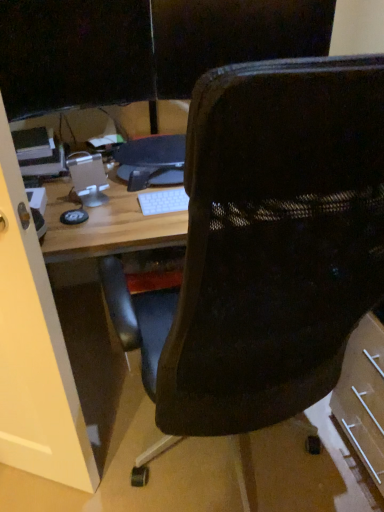
Describe the element at coordinates (152, 161) in the screenshot. I see `black plastic monitor at center` at that location.

Image resolution: width=384 pixels, height=512 pixels. What do you see at coordinates (74, 54) in the screenshot? I see `black glossy monitor at upper left` at bounding box center [74, 54].

Locate an element on the screen. This screenshot has height=512, width=384. black mesh chair at center is located at coordinates (266, 245).

You are a GUI agent. You are given a task and a screenshot of the screen. Output one action in this format:
    pyautogui.click(x=<x>, y=<y>)
    Task: Click on the black mesh chair at upper center
    The width and height of the screenshot is (384, 512).
    Given the screenshot: What is the action you would take?
    pyautogui.click(x=232, y=36)

Measure the distance between black plastic monitor at center and black mesh chair at center.

black plastic monitor at center is 26.64 inches from black mesh chair at center.

Is point (123, 150) positioned before point (271, 279)?

No, (123, 150) is behind (271, 279).

Which of these two, black plastic monitor at center or black mesh chair at center, is thinner?

black plastic monitor at center is thinner.

Based on the photo, which object is positioned more to the left, black plastic monitor at center or black mesh chair at center?

black plastic monitor at center.

Consider the image. Considering the positions of objects black glossy monitor at upper left and black mesh chair at upper center in the image provided, who is behind, black glossy monitor at upper left or black mesh chair at upper center?

black mesh chair at upper center is more distant.

Where is `back lying on the right of black glossy monitor at upper left`? This screenshot has height=512, width=384. back lying on the right of black glossy monitor at upper left is located at coordinates (232, 36).

From the picture: Is black glossy monitor at upper left facing away from black mesh chair at upper center?

black glossy monitor at upper left is not turned away from black mesh chair at upper center.

Looking at their sizes, would you say black glossy monitor at upper left is wider or thinner than black mesh chair at upper center?

In the image, black glossy monitor at upper left appears to be more narrow than black mesh chair at upper center.

Which object is wider, transparent glass door at left or black mesh chair at upper center?

Wider between the two is transparent glass door at left.

Could you tell me if transparent glass door at left is turned towards black mesh chair at upper center?

No, transparent glass door at left is not turned towards black mesh chair at upper center.

From a real-world perspective, is transparent glass door at left located beneath black mesh chair at upper center?

Yes, from a real-world perspective, transparent glass door at left is below black mesh chair at upper center.

How different are the orientations of black glossy monitor at upper left and black plastic monitor at center in degrees?

21.8 degrees separate the facing orientations of black glossy monitor at upper left and black plastic monitor at center.

Locate an element on the screen. This screenshot has height=512, width=384. computer monitor on the left side of black plastic monitor at center is located at coordinates (74, 54).

Which of these two, black glossy monitor at upper left or black plastic monitor at center, is bigger?

Bigger between the two is black glossy monitor at upper left.

From a real-world perspective, between black glossy monitor at upper left and black plastic monitor at center, who is vertically lower?

black plastic monitor at center.

How distant is black mesh chair at upper center from transparent glass door at left?

The distance of black mesh chair at upper center from transparent glass door at left is 3.64 feet.

From the image's perspective, would you say black mesh chair at upper center is shown under transparent glass door at left?

No, from the image's perspective, black mesh chair at upper center is not beneath transparent glass door at left.

Is black mesh chair at upper center spatially inside transparent glass door at left, or outside of it?

The correct answer is: outside.

Is black mesh chair at upper center facing towards transparent glass door at left?

No, black mesh chair at upper center is not facing towards transparent glass door at left.

Is black plastic monitor at center closer to the viewer compared to black mesh chair at upper center?

No, it is not.

Is black plastic monitor at center surrounding black mesh chair at upper center?

No.

Is black plastic monitor at center next to black mesh chair at upper center and touching it?

No, black plastic monitor at center is not in contact with black mesh chair at upper center.

In the scene shown: Does black plastic monitor at center have a larger size compared to black mesh chair at upper center?

Actually, black plastic monitor at center might be smaller than black mesh chair at upper center.

In terms of height, does black mesh chair at upper center look taller or shorter compared to black glossy monitor at upper left?

black mesh chair at upper center is shorter than black glossy monitor at upper left.

Based on the photo, measure the distance between black mesh chair at upper center and black glossy monitor at upper left.

black mesh chair at upper center is 10.95 inches away from black glossy monitor at upper left.

Could you tell me if black mesh chair at upper center is turned towards black glossy monitor at upper left?

No.

This screenshot has width=384, height=512. Find the location of `computer monitor on the left of black mesh chair at upper center`. computer monitor on the left of black mesh chair at upper center is located at coordinates (74, 54).

At what (x,y) coordinates should I click in order to perform the action: click on chair lying below the black plastic monitor at center (from the image's perspective). Please return your answer as a coordinate pair (x, y). This screenshot has width=384, height=512. Looking at the image, I should click on (266, 245).

Where is `computer monitor below the black mesh chair at upper center (from a real-world perspective)`? This screenshot has width=384, height=512. computer monitor below the black mesh chair at upper center (from a real-world perspective) is located at coordinates (74, 54).

Considering their positions, is black glossy monitor at upper left positioned closer to black plastic monitor at center than black mesh chair at upper center?

Based on the image, black glossy monitor at upper left appears to be nearer to black plastic monitor at center.

Looking at this image, which object lies nearer to the anchor point transparent glass door at left, black mesh chair at center or black plastic monitor at center?

Among the two, black mesh chair at center is located nearer to transparent glass door at left.

Estimate the real-world distances between objects in this image. Which object is closer to black glossy monitor at upper left, black mesh chair at center or black mesh chair at upper center?

black mesh chair at upper center is positioned closer to the anchor black glossy monitor at upper left.

Looking at the image, which one is located closer to transparent glass door at left, black mesh chair at upper center or black plastic monitor at center?

black plastic monitor at center.

Estimate the real-world distances between objects in this image. Which object is closer to black mesh chair at center, transparent glass door at left or black glossy monitor at upper left?

transparent glass door at left is positioned closer to the anchor black mesh chair at center.

In the scene shown: Looking at the image, which one is located closer to transparent glass door at left, black plastic monitor at center or black glossy monitor at upper left?

The object closer to transparent glass door at left is black plastic monitor at center.

Based on their spatial positions, is black plastic monitor at center or black mesh chair at upper center further from black glossy monitor at upper left?

black plastic monitor at center is further to black glossy monitor at upper left.

When comparing their distances from black plastic monitor at center, does black mesh chair at upper center or transparent glass door at left seem further?

Among the two, transparent glass door at left is located further to black plastic monitor at center.

At what (x,y) coordinates should I click in order to perform the action: click on computer between black glossy monitor at upper left and black mesh chair at upper center. Please return your answer as a coordinate pair (x, y). The width and height of the screenshot is (384, 512). Looking at the image, I should click on (152, 161).

You are a GUI agent. You are given a task and a screenshot of the screen. Output one action in this format:
    pyautogui.click(x=<x>, y=<y>)
    Task: Click on the glass door between black mesh chair at center and black mesh chair at upper center from front to back
    The height and width of the screenshot is (512, 384).
    Given the screenshot: What is the action you would take?
    pyautogui.click(x=34, y=349)

The height and width of the screenshot is (512, 384). In order to click on computer monitor between black mesh chair at upper center and transparent glass door at left in the up-down direction in this screenshot , I will do `click(74, 54)`.

This screenshot has width=384, height=512. Find the location of `computer monitor between black mesh chair at center and black mesh chair at upper center from front to back`. computer monitor between black mesh chair at center and black mesh chair at upper center from front to back is located at coordinates (74, 54).